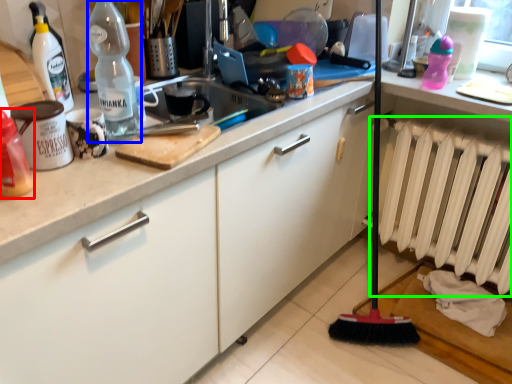
Question: Which object is positioned farthest from bottle (highlighted by a red box)? Select from bottle (highlighted by a blue box) and radiator (highlighted by a green box).

Choices:
 (A) bottle
 (B) radiator

Answer: (B)